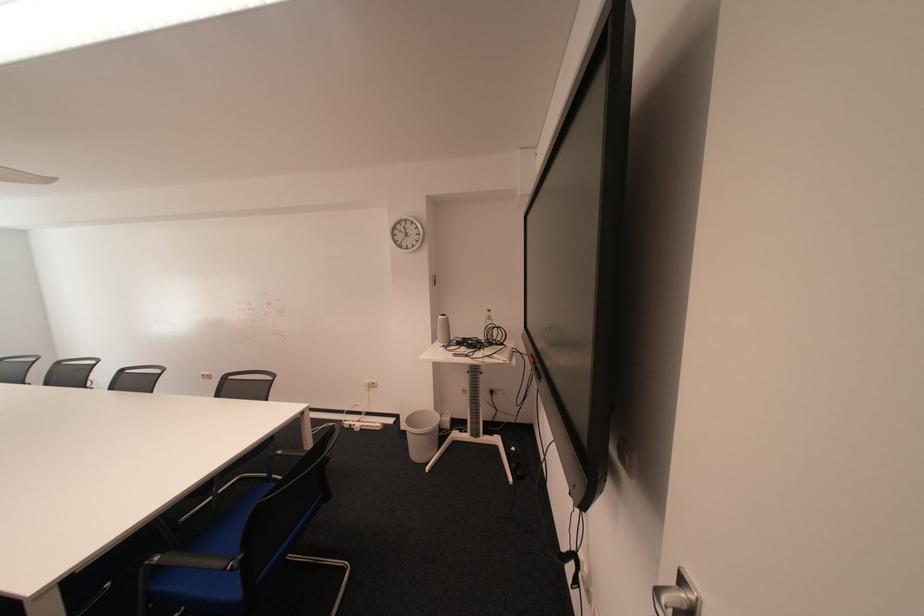
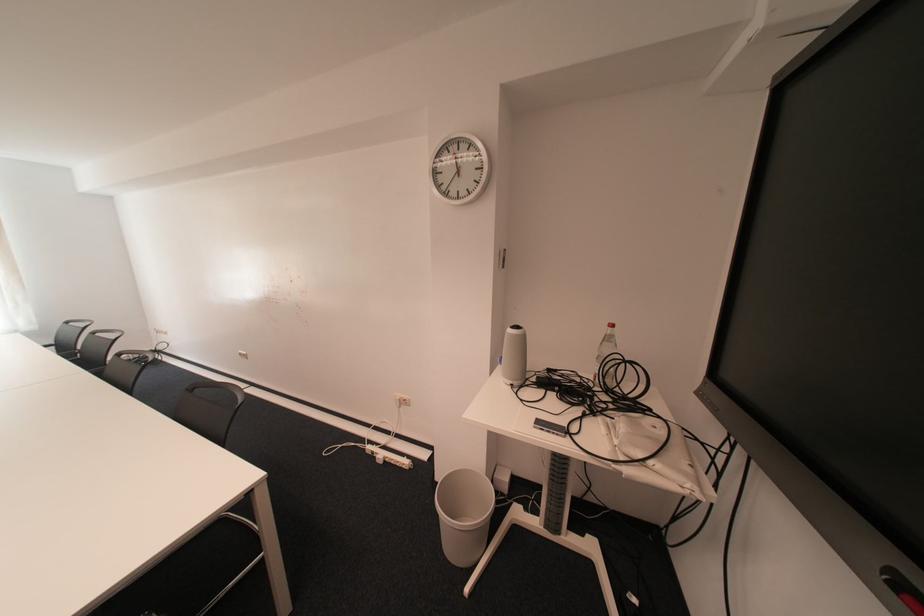
Where in the second image is the point corresponding to point 411,246 from the first image?

(457, 195)